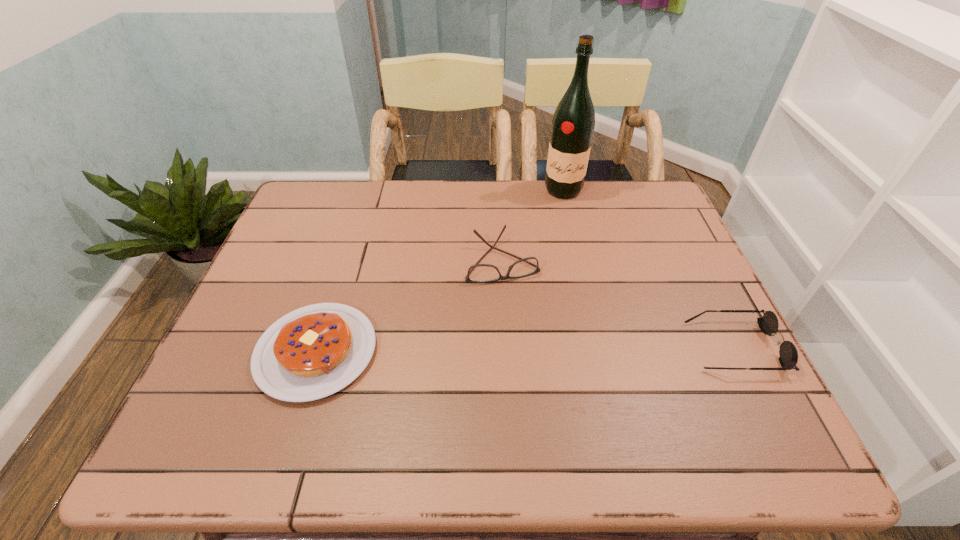
The width and height of the screenshot is (960, 540). I want to click on pancake, so click(312, 352).

The width and height of the screenshot is (960, 540). I want to click on sunglasses, so click(x=768, y=324).

The image size is (960, 540). Identify the location of the third nearest object. coord(479,273).

At what (x,y) coordinates should I click in order to perform the action: click on the third object from right to left. Please return your answer as a coordinate pair (x, y). The image size is (960, 540). Looking at the image, I should click on coord(479,273).

At what (x,y) coordinates should I click in order to perform the action: click on the second object from right to left. Please return your answer as a coordinate pair (x, y). Looking at the image, I should click on click(x=573, y=123).

You are a GUI agent. You are given a task and a screenshot of the screen. Output one action in this format:
    pyautogui.click(x=<x>, y=<y>)
    Task: Click on the liquor
    The height and width of the screenshot is (540, 960).
    Given the screenshot: What is the action you would take?
    pyautogui.click(x=573, y=123)

In order to click on vacant space located on the right of the leftmost object in this screenshot , I will do tap(448, 352).

At what (x,y) coordinates should I click in order to perform the action: click on free space located on the front-facing side of the spectacles. Please return your answer as a coordinate pair (x, y). This screenshot has width=960, height=540. Looking at the image, I should click on (518, 306).

Where is `vacant space located 0.320m on the front-facing side of the spectacles`? vacant space located 0.320m on the front-facing side of the spectacles is located at coordinates (547, 392).

The height and width of the screenshot is (540, 960). I want to click on free location located 0.140m on the front-facing side of the spectacles, so click(524, 325).